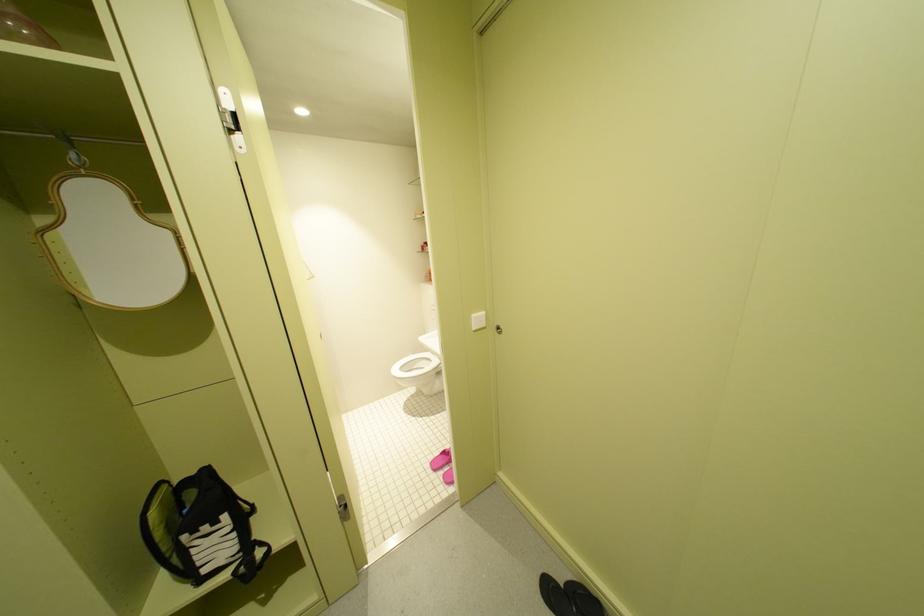
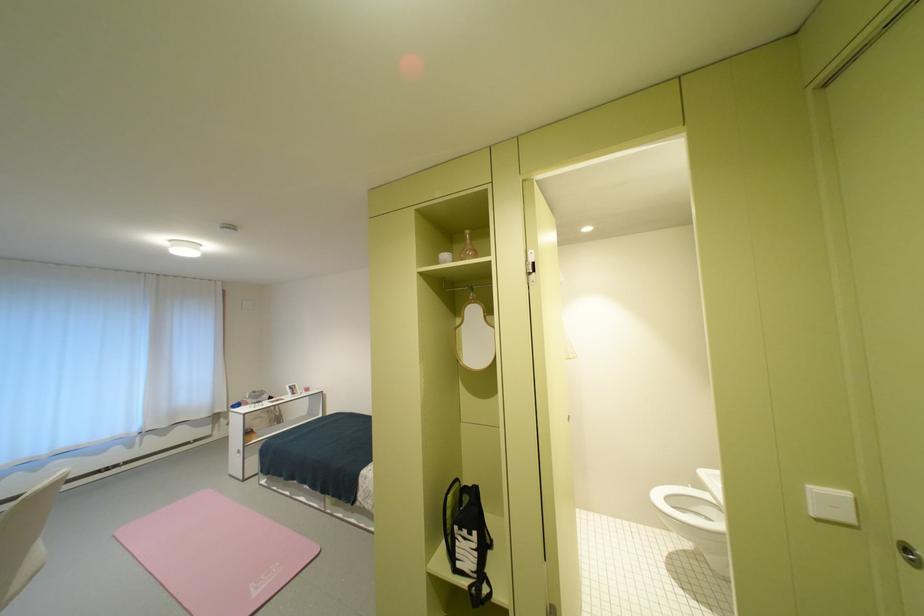
The point at (410, 370) is marked in the first image. Where is the corresponding point in the second image?

(677, 500)